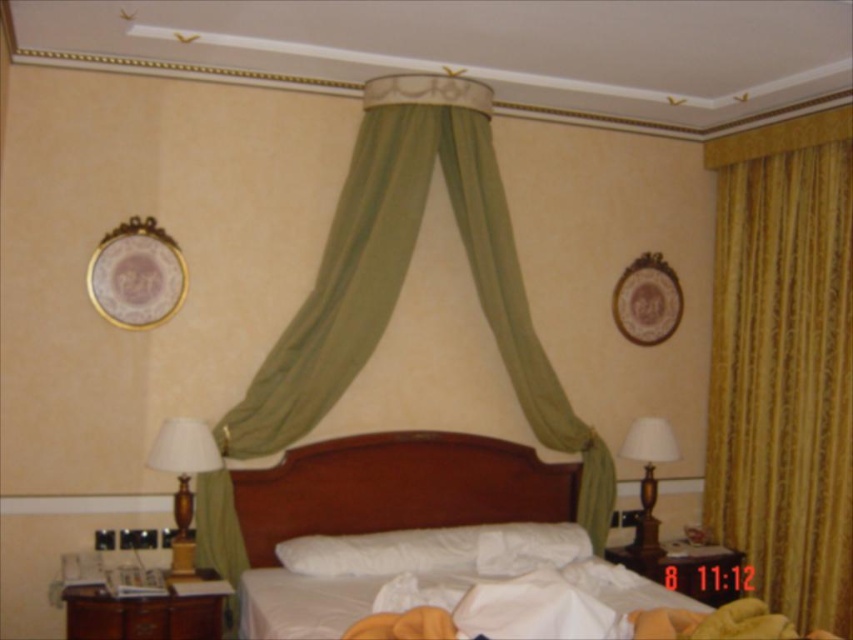
Question: Which point appears farthest from the camera in this image?

Choices:
 (A) (286, 470)
 (B) (161, 428)
 (C) (173, 625)

Answer: (A)

Question: Which of these objects is positioned farthest from the white soft pillow at center?

Choices:
 (A) matte gold lamp at left
 (B) matte brown lamp at right
 (C) gold textured curtain at right
 (D) green sheer curtain at center

Answer: (C)

Question: Does wooden headboard at center appear under matte gold lamp at left?

Choices:
 (A) no
 (B) yes

Answer: (B)

Question: Can you confirm if gold textured curtain at right is thinner than brown wooden dresser at lower left?

Choices:
 (A) yes
 (B) no

Answer: (A)

Question: Estimate the real-world distances between objects in this image. Which object is closer to the wooden bed at center?

Choices:
 (A) matte gold lamp at left
 (B) green sheer curtain at center

Answer: (B)

Question: Can you confirm if wooden headboard at center is bigger than white soft pillow at center?

Choices:
 (A) no
 (B) yes

Answer: (B)